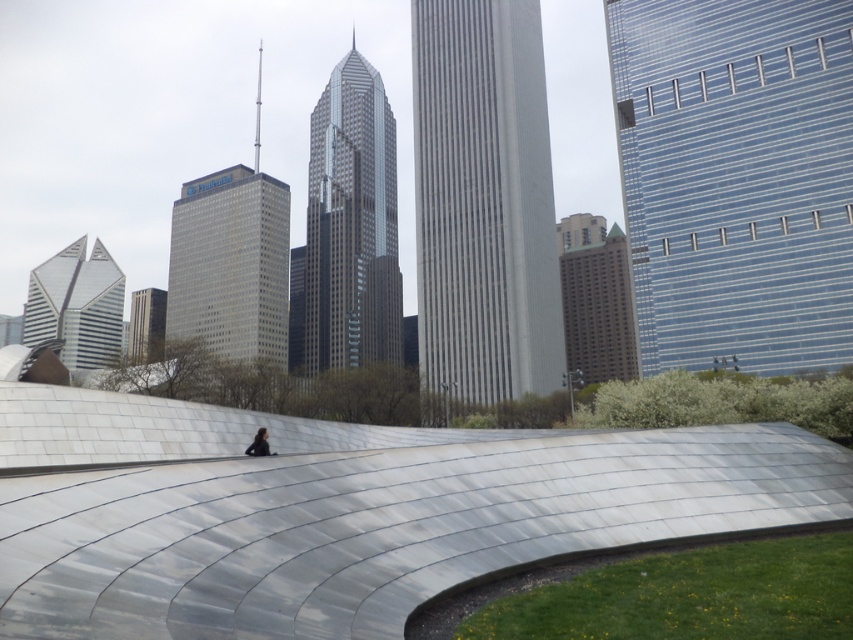
You are an architect evaluating the urban layout. Considering the silver metallic park at center and the blue glass skyscraper at upper right, which structure is taller?

The blue glass skyscraper at upper right is taller than the silver metallic park at center.

You are standing at the entrance of the urban landscape and want to reach the silver metallic park at center. Which direction should you head towards?

The silver metallic park at center is located at point [344,509], so you should head towards the center of the scene to reach it.

You are a tourist standing in the middle of the city and see the silver metallic park at center and the blue glass skyscraper at upper right. Which one is closer to you?

The silver metallic park at center is closer to you because it is located below the blue glass skyscraper at upper right, indicating it is in a lower position relative to the observer.